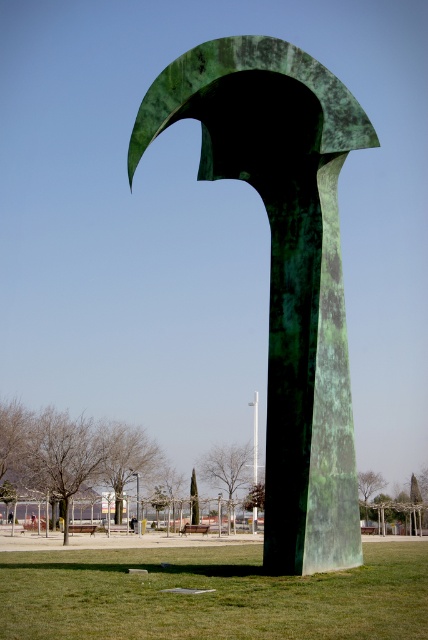
You are standing in the park and want to take a photo of the green patinated metal arch at center and the green grass at center. Which object will appear closer to you in the photo?

The green patinated metal arch at center will appear closer to you in the photo because it is positioned further to the viewer than the green grass at center.

You are standing in a park and see the green patinated metal arch at center. If you want to take a photo of it using a standard smartphone camera, which has a maximum zoom range of 10 meters, will you be able to capture the entire sculpture without moving closer?

The green patinated metal arch at center is 16.81 meters away from the viewer. Since the smartphone camera has a maximum zoom range of 10 meters, you will not be able to capture the entire sculpture without moving closer.

You are a landscape architect designing a new park and want to place a small bench between the green patinated metal arch at center and the green grass at center. Since the bench is 1.2 meters tall, will it be taller than both objects?

The green patinated metal arch at center has a greater height compared to green grass at center. However, the bench is 1.2 meters tall, but the height of the metal arch isn not specified. Therefore, it is impossible to determine if the bench will be taller than both objects without additional information.